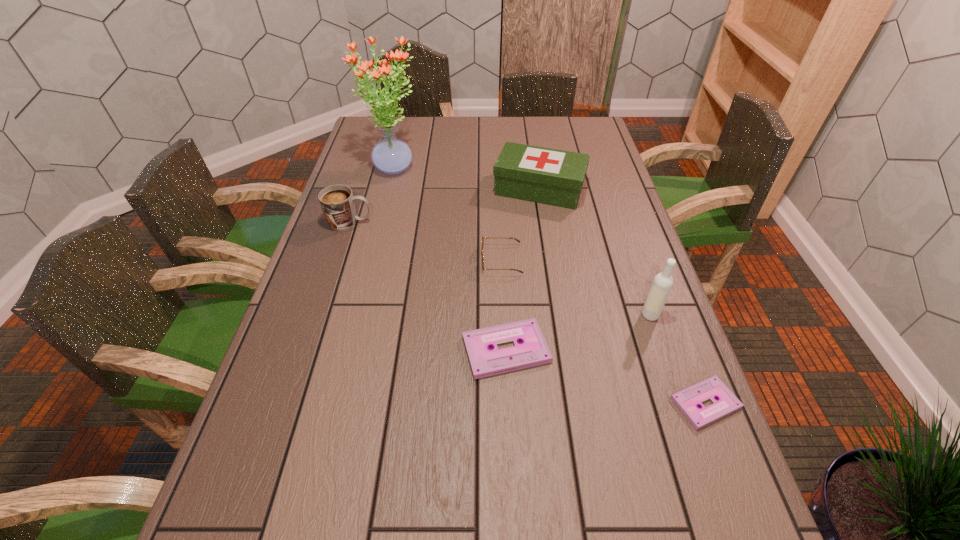
I want to click on the taller videotape, so click(533, 350).

Find the location of a particular element. The width and height of the screenshot is (960, 540). the left videotape is located at coordinates (533, 350).

Find the location of a particular element. This screenshot has height=540, width=960. the right videotape is located at coordinates (687, 400).

At what (x,y) coordinates should I click in order to perform the action: click on the shorter videotape. Please return your answer as a coordinate pair (x, y). The height and width of the screenshot is (540, 960). Looking at the image, I should click on (687, 400).

What are the coordinates of `the first-aid kit` in the screenshot? It's located at (549, 176).

This screenshot has height=540, width=960. I want to click on the tallest object, so click(391, 155).

I want to click on sunglasses, so tap(517, 240).

Find the location of a particular element. This screenshot has height=540, width=960. the fourth farthest object is located at coordinates (517, 240).

You are a GUI agent. You are given a task and a screenshot of the screen. Output one action in this format:
    pyautogui.click(x=<x>, y=<y>)
    Task: Click on the third farthest object
    
    Given the screenshot: What is the action you would take?
    pyautogui.click(x=337, y=201)

I want to click on the fifth farthest object, so (x=662, y=284).